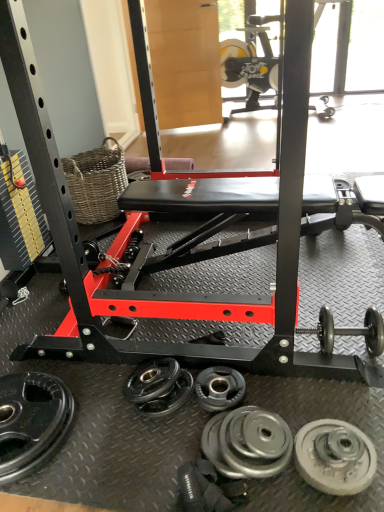
Find the location of a particular element. free space to the back side of black rubber weight plate at center, the third wheel viewed from the right is located at coordinates (216, 343).